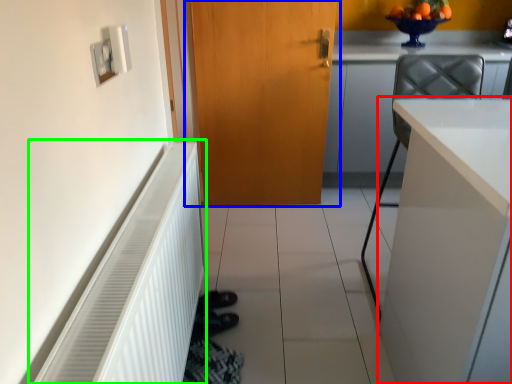
Question: Based on their relative distances, which object is nearer to cabinetry (highlighted by a red box)? Choose from door (highlighted by a blue box) and radiator (highlighted by a green box).

Choices:
 (A) door
 (B) radiator

Answer: (B)